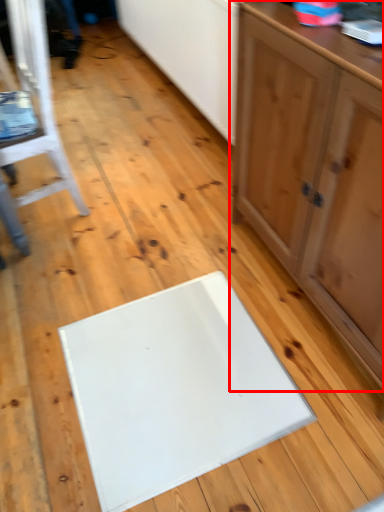
Question: From the image's perspective, where is cabinetry (annotated by the red box) located in relation to furniture in the image?

Choices:
 (A) below
 (B) above

Answer: (A)